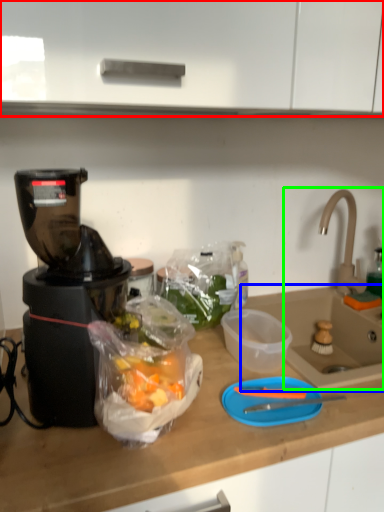
Question: Estimate the real-world distances between objects in this image. Which object is closer to cabinetry (highlighted by a red box), sink (highlighted by a blue box) or sink (highlighted by a green box)?

Choices:
 (A) sink
 (B) sink

Answer: (B)